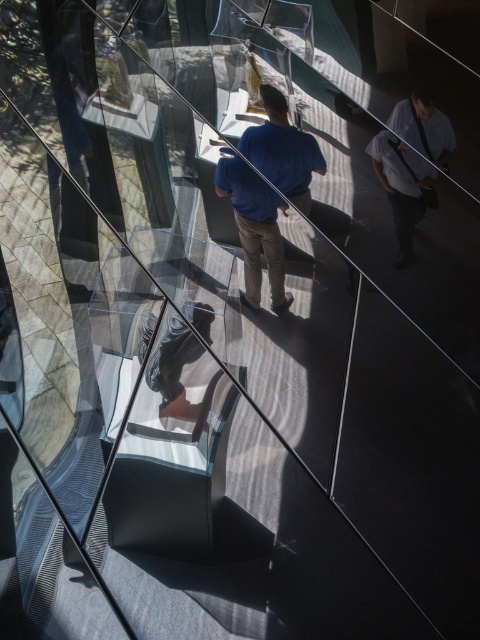
In the scene shown: You are planning to hang a decorative banner between the blue cotton shirt at center and the light blue shirt at right. Based on their positions, which side of the banner should you attach to accommodate the width difference?

The blue cotton shirt at center might be wider than light blue shirt at right, so you should attach the wider side of the banner to the blue cotton shirt at center to match their widths.

You are a photographer trying to capture a group photo of the blue cotton shirt at center and the light blue shirt at right. If your camera has a minimum focus distance of 18 inches, will you be able to take the photo without moving either person?

The blue cotton shirt at center and light blue shirt at right are 18.27 inches apart. Since the minimum focus distance is 18 inches, the photographer can take the photo as the distance between them is slightly more than the required distance.